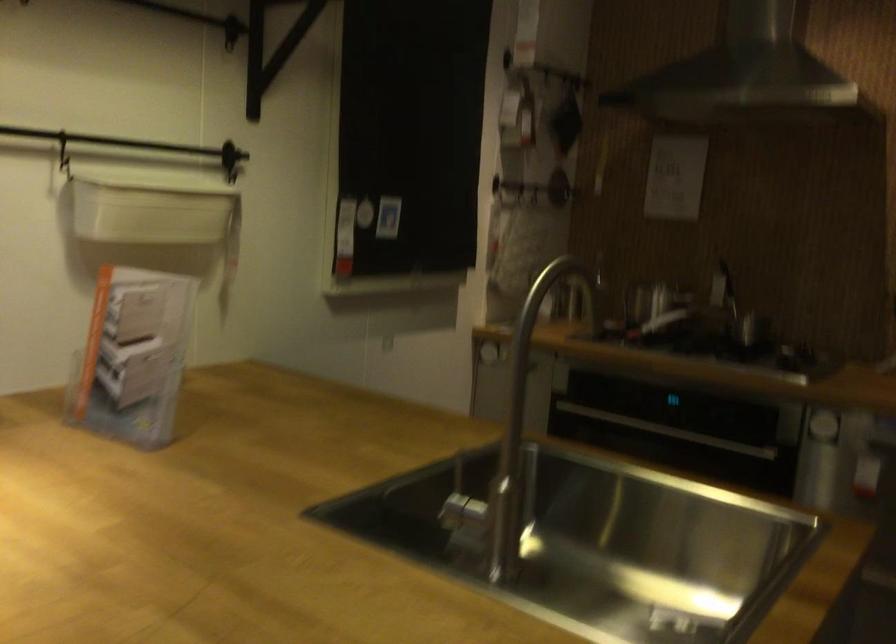
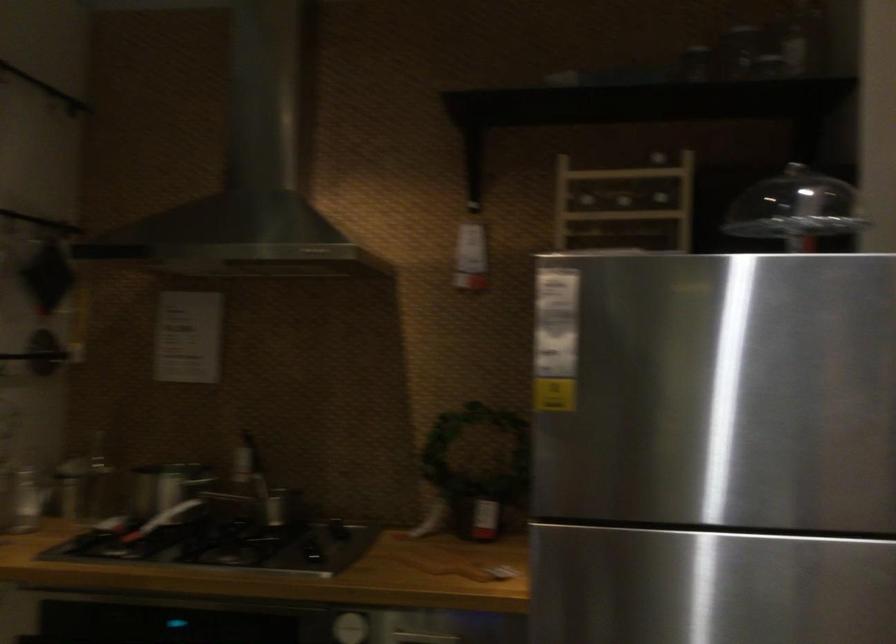
Question: Based on the continuous images, in which direction is the camera rotating? Reply with the corresponding letter.

Choices:
 (A) Left
 (B) Right
 (C) Up
 (D) Down

Answer: (B)